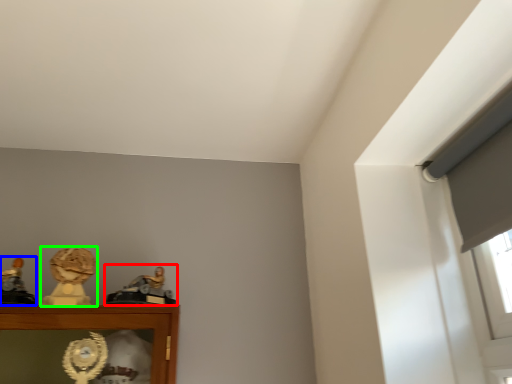
Question: Based on their relative distances, which object is nearer to character sculpture (highlighted by a red box)? Choose from character sculpture (highlighted by a blue box) and character sculpture (highlighted by a green box).

Choices:
 (A) character sculpture
 (B) character sculpture

Answer: (B)